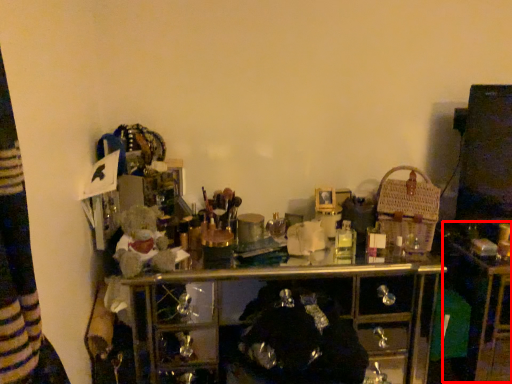
Question: From the image's perspective, what is the correct spatial positioning of computer desk (annotated by the red box) in reference to basket?

Choices:
 (A) above
 (B) below

Answer: (B)